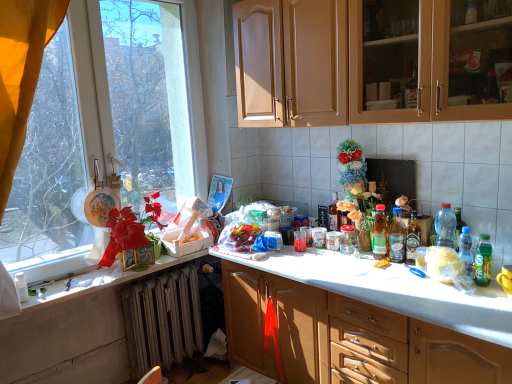
This screenshot has height=384, width=512. What are the coordinates of `free space above gray metallic radiator at lower left (from a real-world perspective)` in the screenshot? It's located at (156, 279).